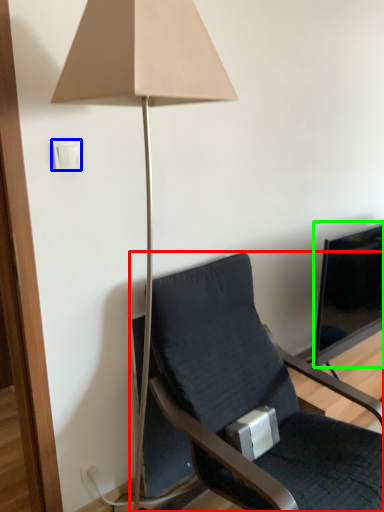
Question: Considering the real-world distances, which object is closest to chair (highlighted by a red box)? light switch (highlighted by a blue box) or television (highlighted by a green box).

Choices:
 (A) light switch
 (B) television

Answer: (B)